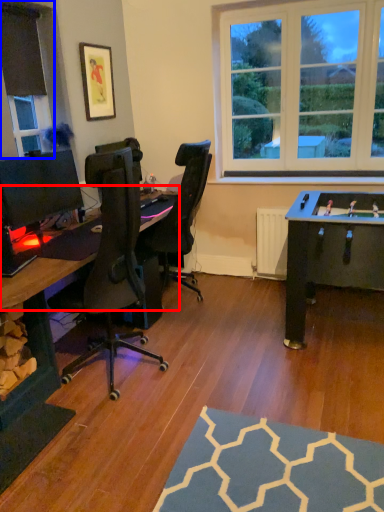
Question: Among these objects, which one is nearest to the camera, computer desk (highlighted by a red box) or window frame (highlighted by a blue box)?

Choices:
 (A) computer desk
 (B) window frame

Answer: (A)